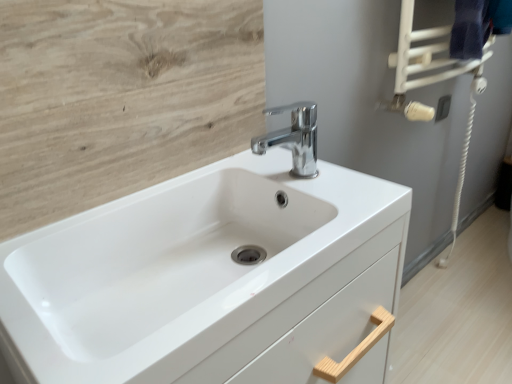
Image resolution: width=512 pixels, height=384 pixels. Find the location of `free spot to the right of chrome metallic faucet at center`. free spot to the right of chrome metallic faucet at center is located at coordinates (351, 183).